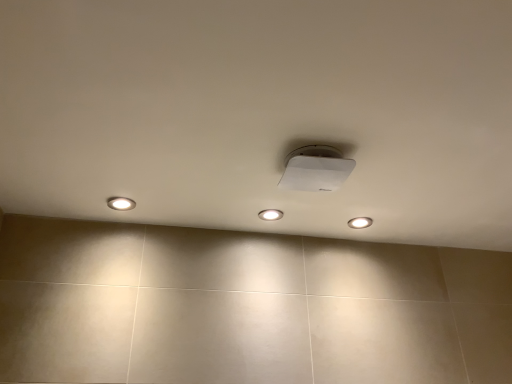
Question: Can you confirm if white glossy light fixture at center, placed as the second dot when sorted from right to left, is positioned to the right of matte white light at left, the 3th dot when ordered from right to left?

Choices:
 (A) yes
 (B) no

Answer: (A)

Question: Considering the relative sizes of white glossy light fixture at center, acting as the second dot starting from the left, and matte white light at left, the 3th dot when ordered from right to left, in the image provided, is white glossy light fixture at center, acting as the second dot starting from the left, shorter than matte white light at left, the 3th dot when ordered from right to left,?

Choices:
 (A) no
 (B) yes

Answer: (B)

Question: Is white glossy light fixture at center, arranged as the second dot when viewed from the front, positioned with its back to matte white light at left, acting as the first dot starting from the left?

Choices:
 (A) yes
 (B) no

Answer: (B)

Question: From the image's perspective, is white glossy light fixture at center, acting as the second dot starting from the left, beneath matte white light at left, which is counted as the 1th dot, starting from the front?

Choices:
 (A) yes
 (B) no

Answer: (A)

Question: Is white glossy light fixture at center, arranged as the second dot when viewed from the front, facing towards matte white light at left, acting as the first dot starting from the left?

Choices:
 (A) yes
 (B) no

Answer: (B)

Question: Is point (269, 211) positioned closer to the camera than point (365, 220)?

Choices:
 (A) closer
 (B) farther

Answer: (A)

Question: Would you say white glossy light fixture at center, acting as the second dot starting from the left, is inside or outside white glossy light fixture at upper center, acting as the 3th dot starting from the front?

Choices:
 (A) outside
 (B) inside

Answer: (A)

Question: From the image's perspective, is white glossy light fixture at center, placed as the second dot when sorted from right to left, located above or below white glossy light fixture at upper center, which appears as the third dot when viewed from the left?

Choices:
 (A) above
 (B) below

Answer: (A)

Question: In terms of width, does white glossy light fixture at center, acting as the second dot starting from the left, look wider or thinner when compared to white glossy light fixture at upper center, the 1th dot viewed from the back?

Choices:
 (A) thin
 (B) wide

Answer: (B)

Question: Is point (108, 205) positioned closer to the camera than point (263, 210)?

Choices:
 (A) closer
 (B) farther

Answer: (A)

Question: From the image's perspective, is matte white light at left, the third dot when ordered from back to front, located above or below white glossy light fixture at center, placed as the second dot when sorted from right to left?

Choices:
 (A) below
 (B) above

Answer: (B)

Question: Is matte white light at left, the third dot when ordered from back to front, wider or thinner than white glossy light fixture at center, which appears as the 2th dot when viewed from the back?

Choices:
 (A) thin
 (B) wide

Answer: (B)

Question: Considering their positions, is matte white light at left, acting as the first dot starting from the left, located in front of or behind white glossy light fixture at center, which appears as the 2th dot when viewed from the back?

Choices:
 (A) front
 (B) behind

Answer: (A)

Question: Looking at the image, does white glossy light fixture at upper center, which is the first dot in right-to-left order, seem bigger or smaller compared to matte white light at left, which is counted as the 1th dot, starting from the front?

Choices:
 (A) big
 (B) small

Answer: (B)

Question: Do you think white glossy light fixture at upper center, which appears as the third dot when viewed from the left, is within matte white light at left, the 3th dot when ordered from right to left, or outside of it?

Choices:
 (A) outside
 (B) inside

Answer: (A)